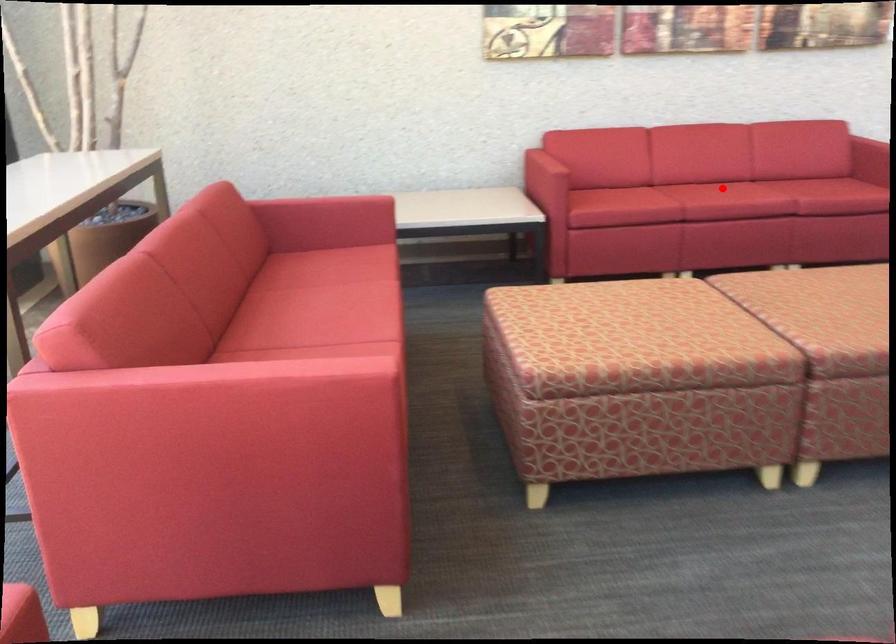
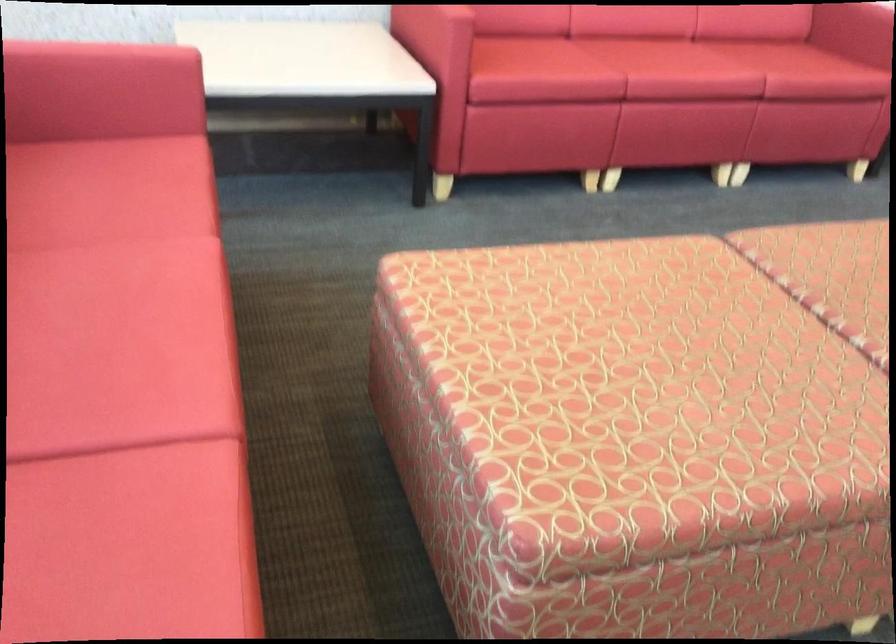
Question: A red point is marked in image1. In image2, is the corresponding 3D point closer to the camera or farther? Reply with the corresponding letter.

Choices:
 (A) The corresponding 3D point is closer.
 (B) The corresponding 3D point is farther.

Answer: (A)